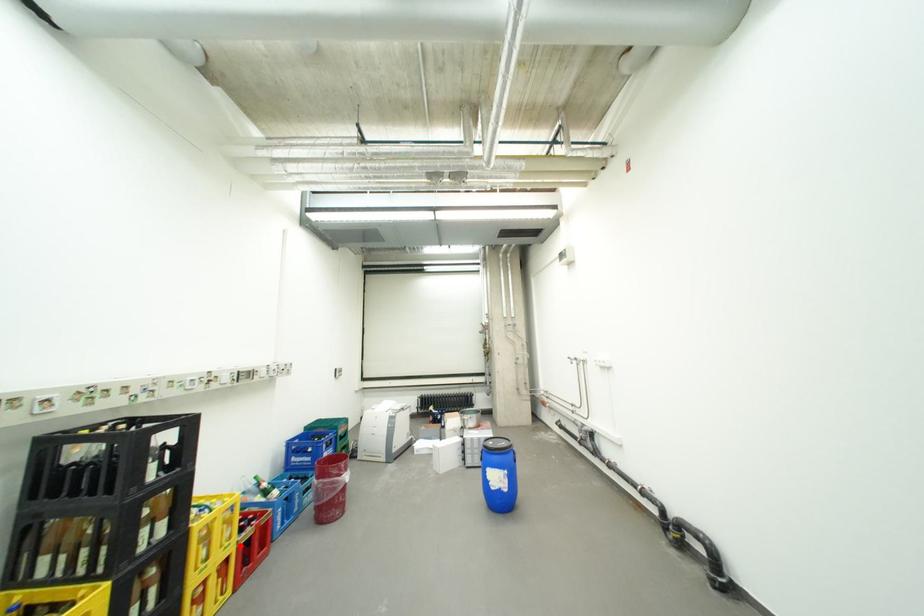
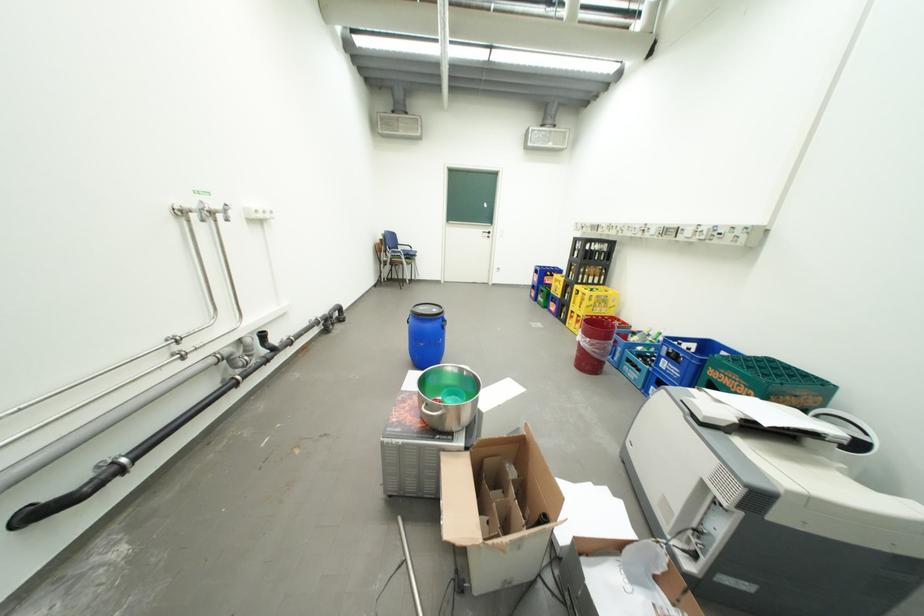
Where in the second image is the point corresponding to the highlighted location from the first image?

(590, 312)